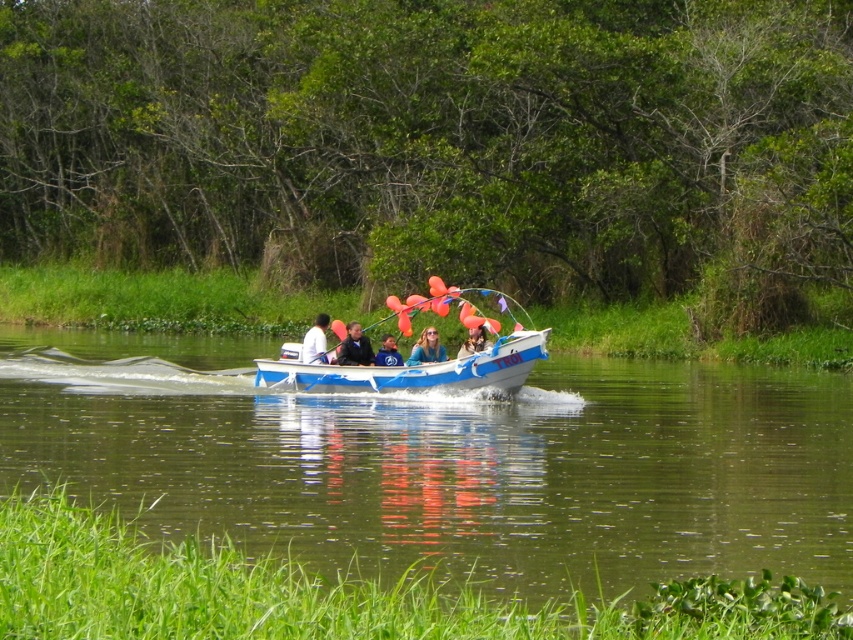
Question: Where is blue glossy boat at center located in relation to blue fabric shirt at center in the image?

Choices:
 (A) left
 (B) right

Answer: (B)

Question: Is dark blue suit at center thinner than matte blue shirt at center?

Choices:
 (A) yes
 (B) no

Answer: (A)

Question: Which point appears closest to the camera in this image?

Choices:
 (A) [369, 355]
 (B) [390, 358]
 (C) [505, 362]
 (D) [483, 340]

Answer: (C)

Question: Can you confirm if dark blue suit at center is wider than matte blue shirt at center?

Choices:
 (A) yes
 (B) no

Answer: (B)

Question: Which point is farther to the camera?

Choices:
 (A) white fabric shirt at center
 (B) matte blue boat at center
 (C) dark blue suit at center

Answer: (A)

Question: Which point appears farthest from the camera in this image?

Choices:
 (A) (310, 340)
 (B) (349, 356)

Answer: (A)